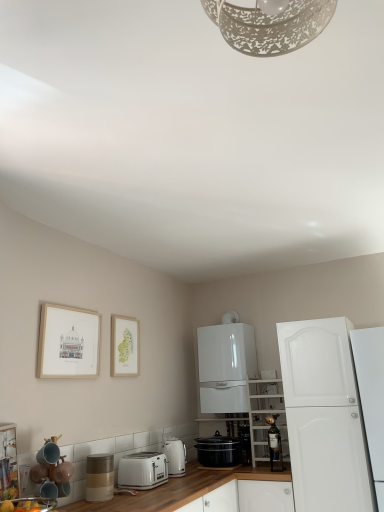
Question: In which direction should I rotate to look at metallic gold wine bottle at center, the 4th appliance positioned from the front?

Choices:
 (A) left
 (B) right

Answer: (B)

Question: Does white matte cabinet at right, acting as the 1th cabinetry starting from the right, have a lesser height compared to white glossy electric kettle at lower center, the second kitchen appliance when ordered from right to left?

Choices:
 (A) no
 (B) yes

Answer: (A)

Question: Does white matte cabinet at right, acting as the 1th cabinetry starting from the right, contain white glossy electric kettle at lower center, which is the 1th kitchen appliance in left-to-right order?

Choices:
 (A) yes
 (B) no

Answer: (B)

Question: Is white matte cabinet at right, the third cabinetry viewed from the left, taller than white glossy electric kettle at lower center, which is the 1th kitchen appliance in left-to-right order?

Choices:
 (A) no
 (B) yes

Answer: (B)

Question: From the image's perspective, is white matte cabinet at right, the third cabinetry viewed from the left, on white glossy electric kettle at lower center, which is the 1th kitchen appliance in left-to-right order?

Choices:
 (A) yes
 (B) no

Answer: (A)

Question: Is white matte cabinet at right, the third cabinetry viewed from the left, smaller than white glossy electric kettle at lower center, the second kitchen appliance when ordered from right to left?

Choices:
 (A) no
 (B) yes

Answer: (A)

Question: Considering the relative sizes of white matte cabinet at right, acting as the 1th cabinetry starting from the right, and white glossy electric kettle at lower center, the second kitchen appliance when ordered from right to left, in the image provided, is white matte cabinet at right, acting as the 1th cabinetry starting from the right, bigger than white glossy electric kettle at lower center, the second kitchen appliance when ordered from right to left,?

Choices:
 (A) yes
 (B) no

Answer: (A)

Question: Is matte white toaster at lower left, the fifth appliance in the back-to-front sequence, at the left side of black matte slow cooker at lower center, the second kitchen appliance when ordered from left to right?

Choices:
 (A) no
 (B) yes

Answer: (B)

Question: Does matte white toaster at lower left, the fifth appliance in the back-to-front sequence, have a lesser width compared to black matte slow cooker at lower center, the second kitchen appliance when ordered from left to right?

Choices:
 (A) no
 (B) yes

Answer: (A)

Question: From the image's perspective, does matte white toaster at lower left, positioned as the 2th appliance in left-to-right order, appear lower than black matte slow cooker at lower center, which is the 1th kitchen appliance from right to left?

Choices:
 (A) yes
 (B) no

Answer: (B)

Question: Does matte white toaster at lower left, the fifth appliance in the back-to-front sequence, have a greater width compared to black matte slow cooker at lower center, which is the 1th kitchen appliance from right to left?

Choices:
 (A) no
 (B) yes

Answer: (B)

Question: From a real-world perspective, is matte white toaster at lower left, positioned as the 2th appliance in left-to-right order, on black matte slow cooker at lower center, the second kitchen appliance when ordered from left to right?

Choices:
 (A) no
 (B) yes

Answer: (A)

Question: Does matte white toaster at lower left, the 1th appliance when ordered from front to back, turn towards black matte slow cooker at lower center, the second kitchen appliance when ordered from left to right?

Choices:
 (A) no
 (B) yes

Answer: (A)

Question: Would you say white matte shelving unit at center-right, which is counted as the 2th cabinetry, starting from the left, is a long distance from black glossy slow cooker at center, positioned as the fourth appliance in left-to-right order?

Choices:
 (A) no
 (B) yes

Answer: (A)